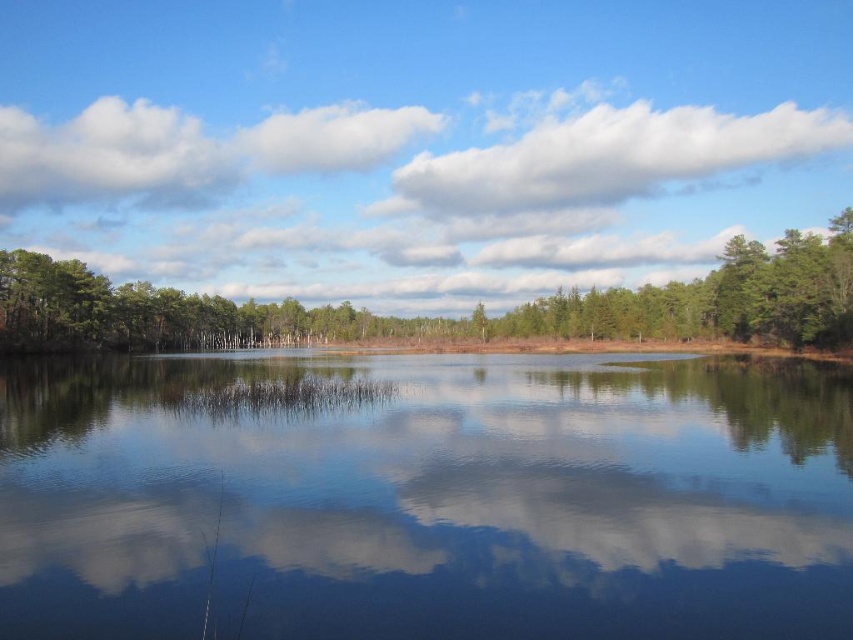
Does point (784, 256) come in front of point (570, 208)?

Yes.

The image size is (853, 640). What do you see at coordinates (447, 320) in the screenshot? I see `green matte tree at upper center` at bounding box center [447, 320].

Locate an element on the screen. This screenshot has width=853, height=640. green matte tree at upper center is located at coordinates (447, 320).

Does smooth water at center appear over green matte tree at upper center?

Incorrect, smooth water at center is not positioned above green matte tree at upper center.

Is smooth water at center further to the viewer compared to green matte tree at upper center?

No.

Who is more forward, (486, 508) or (454, 321)?

Point (486, 508) is in front.

This screenshot has height=640, width=853. Identify the location of smooth water at center. (425, 497).

Can you confirm if smooth water at center is positioned to the right of white fluffy cloud at upper center?

In fact, smooth water at center is to the left of white fluffy cloud at upper center.

Consider the image. Which is below, smooth water at center or white fluffy cloud at upper center?

smooth water at center is lower down.

Which is behind, point (554, 614) or point (399, 204)?

Positioned behind is point (399, 204).

The height and width of the screenshot is (640, 853). Find the location of `smooth water at center`. smooth water at center is located at coordinates (425, 497).